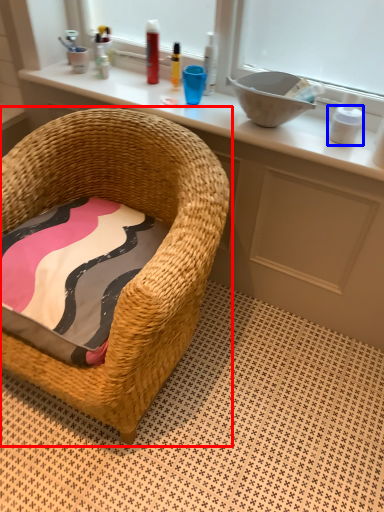
Question: Which object is closer to the camera taking this photo, chair (highlighted by a red box) or toiletry (highlighted by a blue box)?

Choices:
 (A) chair
 (B) toiletry

Answer: (A)